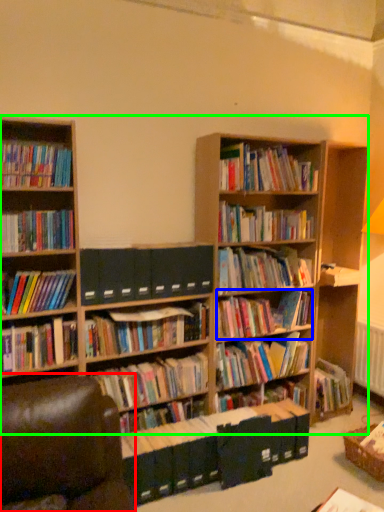
Question: Which object is positioned closest to swivel chair (highlighted by a red box)? Select from book (highlighted by a blue box) and bookcase (highlighted by a green box).

Choices:
 (A) book
 (B) bookcase

Answer: (B)